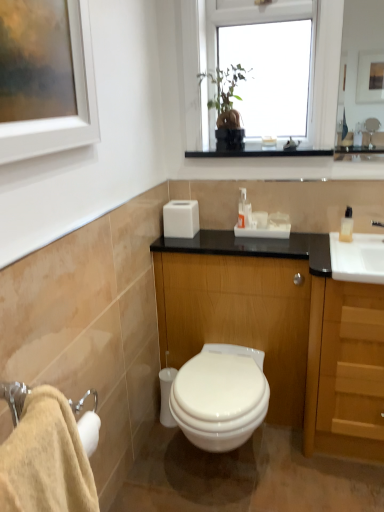
At what (x,y) coordinates should I click in order to perform the action: click on vacant region below white glossy toilet at center (from a real-world perspective). Please return your answer as a coordinate pair (x, y). The height and width of the screenshot is (512, 384). Looking at the image, I should click on point(221,473).